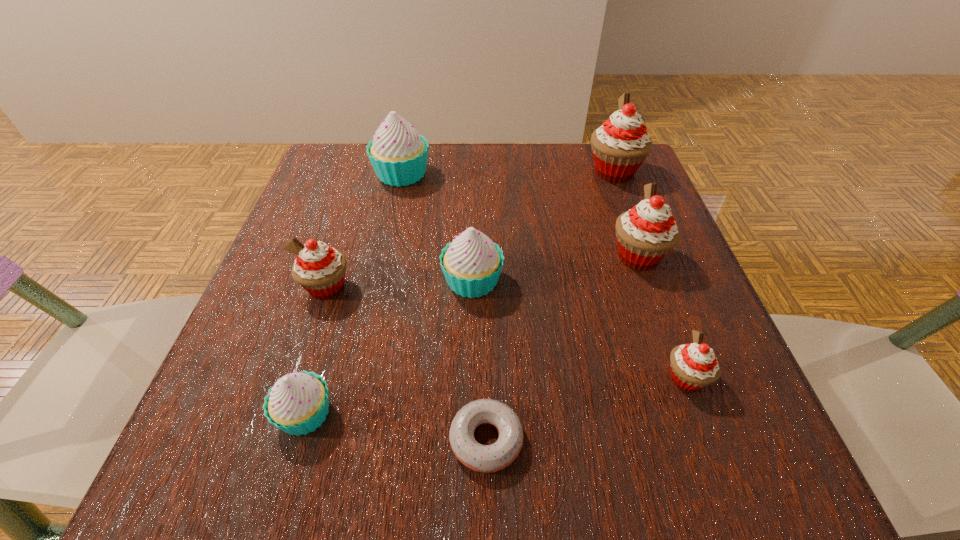
I want to click on free space between the doughnut and the smallest white cupcake, so click(396, 427).

Find the location of a particular element. This screenshot has width=960, height=540. vacant area that lies between the nearest pink cupcake and the shortest object is located at coordinates (586, 409).

Identify the location of free space between the smallest white cupcake and the leftmost pink cupcake. This screenshot has width=960, height=540. (316, 350).

Locate an element on the screen. The image size is (960, 540). vacant area that lies between the smallest pink cupcake and the second smallest white cupcake is located at coordinates 579,329.

Where is `empty space between the biggest white cupcake and the doughnut`? The width and height of the screenshot is (960, 540). empty space between the biggest white cupcake and the doughnut is located at coordinates (444, 307).

Find the location of a particular element. The width and height of the screenshot is (960, 540). free spot between the smallest white cupcake and the shortest object is located at coordinates (396, 427).

At what (x,y) coordinates should I click in order to perform the action: click on free spot between the second farthest white cupcake and the doughnut. Please return your answer as a coordinate pair (x, y). This screenshot has height=540, width=960. Looking at the image, I should click on (479, 360).

Where is `vacant space that is in between the third biggest pink cupcake and the biggest white cupcake`? Image resolution: width=960 pixels, height=540 pixels. vacant space that is in between the third biggest pink cupcake and the biggest white cupcake is located at coordinates pos(364,231).

Select which object appears as the sixth closest to the biggest white cupcake. Please provide its 2D coordinates. Your answer should be formatted as a tuple, i.e. [(x, y)], where the tuple contains the x and y coordinates of a point satisfying the conditions above.

[(482, 458)]

You are a GUI agent. You are given a task and a screenshot of the screen. Output one action in this format:
    pyautogui.click(x=<x>, y=<y>)
    Task: Click on the object that ranks as the seventh closest to the third biggest pink cupcake
    Image resolution: width=960 pixels, height=540 pixels.
    Given the screenshot: What is the action you would take?
    pyautogui.click(x=619, y=147)